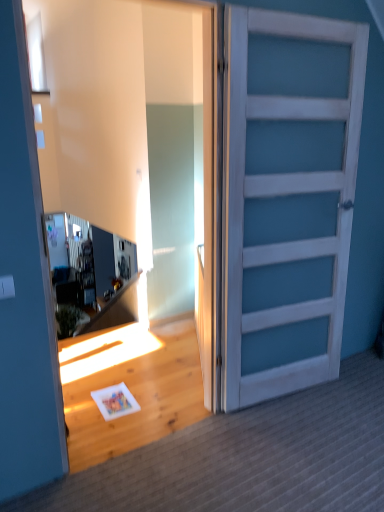
The height and width of the screenshot is (512, 384). Identify the location of vacant region below white wooden door at right (from a real-world perspective). (288, 396).